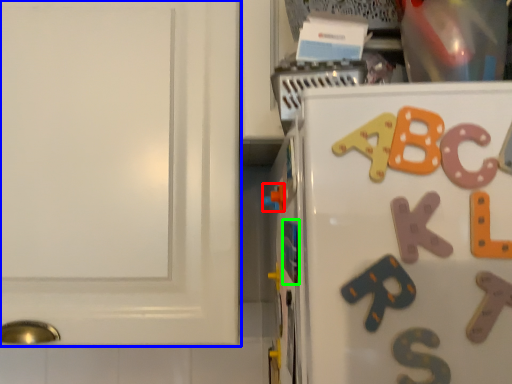
Question: Which object is the closest to the toy (highlighted by a red box)? Choose among these: cabinetry (highlighted by a blue box) or magnet (highlighted by a green box).

Choices:
 (A) cabinetry
 (B) magnet

Answer: (B)